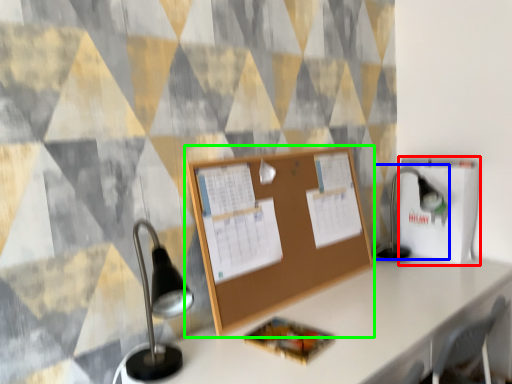
Question: Which object is positioned closest to cardboard box (highlighted by a red box)? Select from table lamp (highlighted by a blue box) and bulletin board (highlighted by a green box).

Choices:
 (A) table lamp
 (B) bulletin board

Answer: (A)